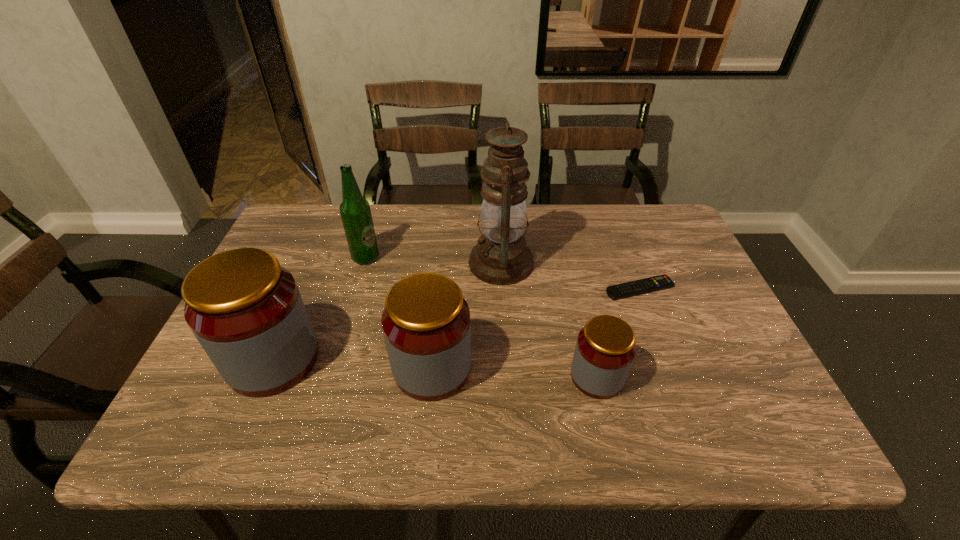
I want to click on blank area located 0.290m on the back of the second tallest jar, so click(x=443, y=258).

Locate an element on the screen. free spot located on the back of the fifth object from left to right is located at coordinates (586, 328).

Find the location of `free point located 0.100m on the label of the beer bottle`. free point located 0.100m on the label of the beer bottle is located at coordinates (415, 258).

The width and height of the screenshot is (960, 540). Find the location of `free spot located on the left of the oil lamp`. free spot located on the left of the oil lamp is located at coordinates (345, 263).

I want to click on free space located on the front of the shortest object, so click(676, 383).

Where is `beer bottle at the far edge`? The height and width of the screenshot is (540, 960). beer bottle at the far edge is located at coordinates (355, 211).

Locate an element on the screen. The width and height of the screenshot is (960, 540). oil lamp positioned at the far edge is located at coordinates (501, 257).

I want to click on object that is at the left edge, so click(x=246, y=311).

Image resolution: width=960 pixels, height=540 pixels. Identify the location of object that is at the right edge. (661, 282).

Locate an element on the screen. The width and height of the screenshot is (960, 540). object situated at the near left corner is located at coordinates (246, 311).